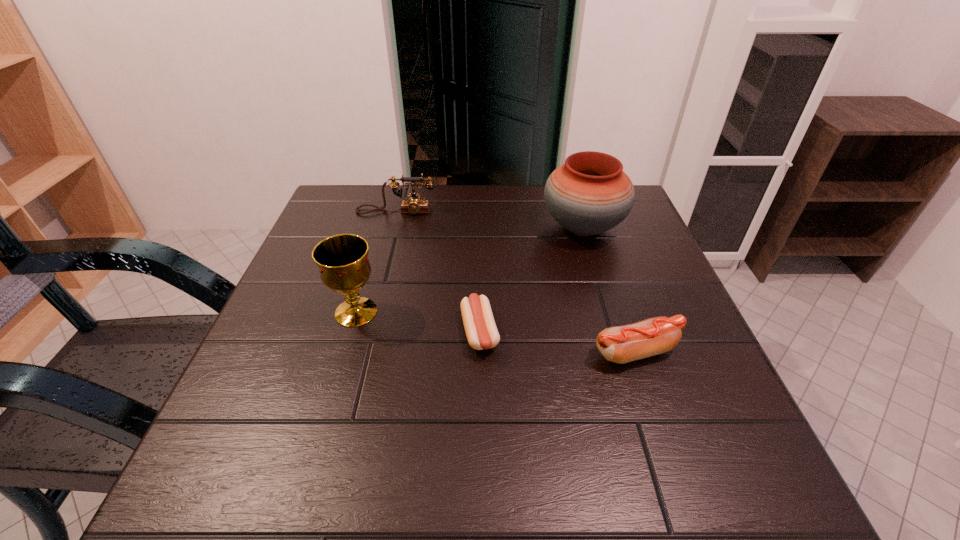
Where is `vacant position in the image that satisfies the following two spatial constraints: 1. on the front-facing side of the telephone; 2. on the right side of the taller sausage`? The width and height of the screenshot is (960, 540). vacant position in the image that satisfies the following two spatial constraints: 1. on the front-facing side of the telephone; 2. on the right side of the taller sausage is located at coordinates (360, 352).